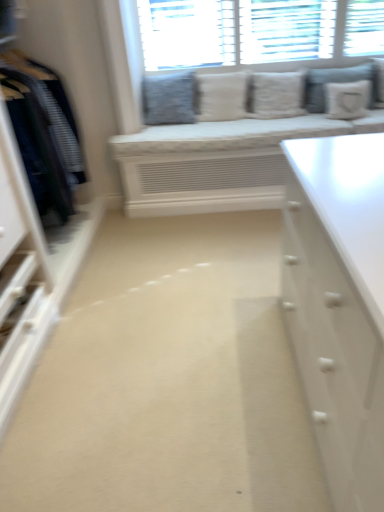
Identify the location of free spot above gray fabric pillow at upper right, which is the second pillow in right-to-left order (from a real-world perspective). (342, 62).